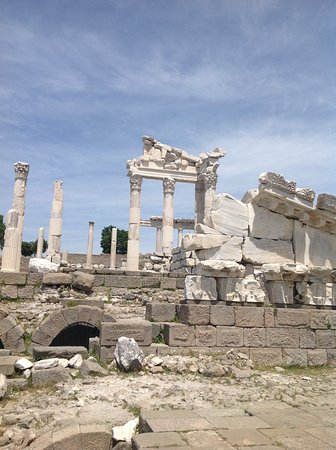
You are a GUI agent. You are given a task and a screenshot of the screen. Output one action in this format:
    pyautogui.click(x=<x>, y=<y>)
    Task: Click on the columns
    This screenshot has width=336, height=450.
    Given the screenshot: What is the action you would take?
    pyautogui.click(x=167, y=211)